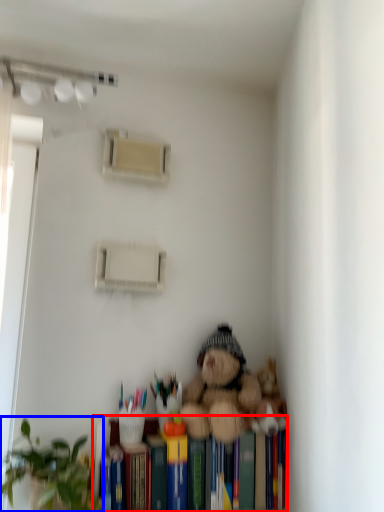
Question: Which point is further to the camera, bookshelf (highlighted by a red box) or houseplant (highlighted by a blue box)?

Choices:
 (A) bookshelf
 (B) houseplant

Answer: (A)